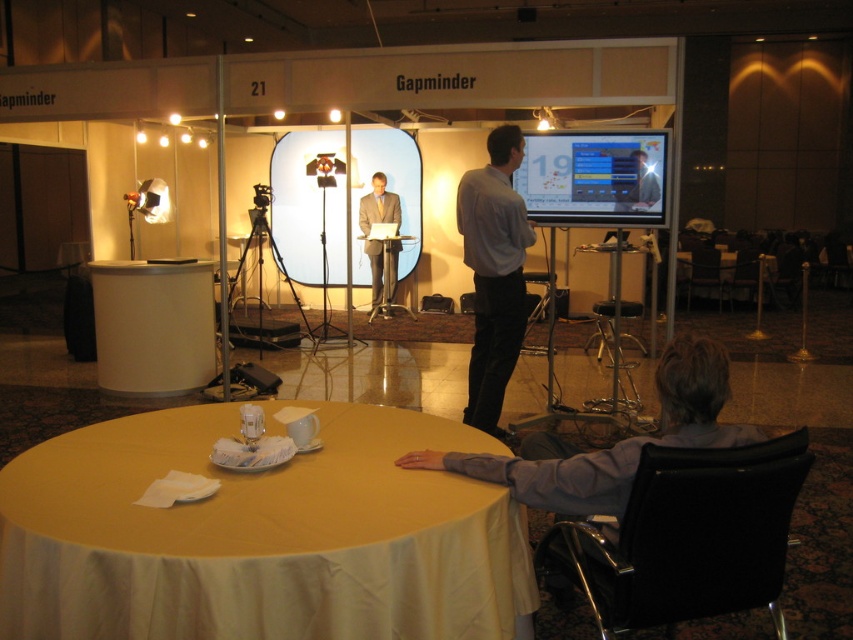
Question: Which of the following is the farthest from the observer?

Choices:
 (A) black leather chair at lower right
 (B) black plastic table at center
 (C) matte white screen at center
 (D) black leather chair at right

Answer: (B)

Question: Which of the following is the farthest from the observer?

Choices:
 (A) (718, 292)
 (B) (465, 470)
 (C) (686, 260)
 (D) (640, 541)

Answer: (A)

Question: Which point appears closest to the camera in this image?

Choices:
 (A) (753, 259)
 (B) (714, 280)
 (C) (236, 477)
 (D) (643, 196)

Answer: (C)

Question: Is yellow fabric-covered table at lower left smaller than gray fabric chair at lower right?

Choices:
 (A) yes
 (B) no

Answer: (B)

Question: Does yellow fabric-covered table at lower left have a greater width compared to matte black laptop at upper center?

Choices:
 (A) no
 (B) yes

Answer: (B)

Question: Is matte white screen at center below light blue shirt at center?

Choices:
 (A) no
 (B) yes

Answer: (A)